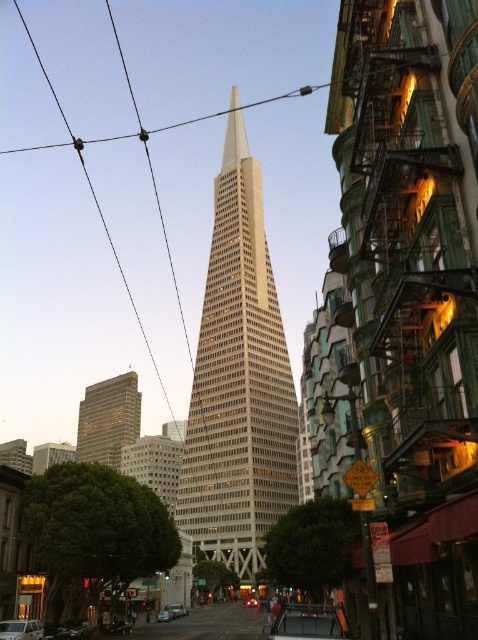
Question: Can you confirm if white plastic car at lower left is thinner than metallic silver car at center?

Choices:
 (A) yes
 (B) no

Answer: (B)

Question: Which of these objects is positioned closest to the shiny black car at lower left?

Choices:
 (A) white plastic car at lower left
 (B) gold reflective glass building at center
 (C) beige glass skyscraper at center

Answer: (A)

Question: Which point is farther to the camera?

Choices:
 (A) metallic wire at upper center
 (B) shiny silver car at center

Answer: (A)

Question: Does beige glass skyscraper at center come behind shiny red car at center?

Choices:
 (A) no
 (B) yes

Answer: (A)

Question: Can you confirm if gold reflective glass building at center is thinner than metallic silver car at center?

Choices:
 (A) no
 (B) yes

Answer: (A)

Question: Estimate the real-world distances between objects in this image. Which object is farther from the metallic silver car at center?

Choices:
 (A) white plastic car at lower left
 (B) shiny black car at lower left

Answer: (A)